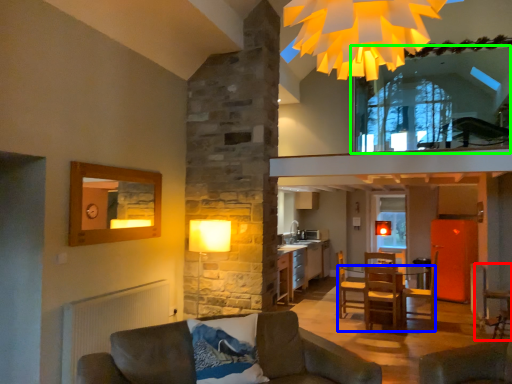
Question: Which is farther away from armchair (highlighted by a red box)? table (highlighted by a blue box) or window (highlighted by a green box)?

Choices:
 (A) table
 (B) window

Answer: (B)